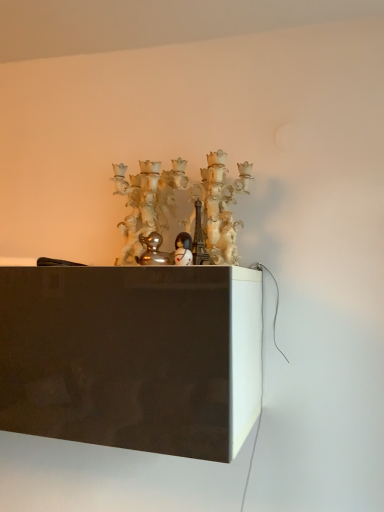
This screenshot has width=384, height=512. I want to click on translucent glass chandelier at center, so click(x=188, y=201).

From the image's perspective, is shiny silver duckling at center, which is counted as the 1th toy, starting from the left, located above or below white glossy figurine at center, which ranks as the 2th toy in left-to-right order?

Clearly, from the image's perspective, shiny silver duckling at center, which is counted as the 1th toy, starting from the left, is above white glossy figurine at center, which ranks as the 2th toy in left-to-right order.

How much distance is there between shiny silver duckling at center, placed as the second toy when sorted from right to left, and white glossy figurine at center, which ranks as the 2th toy in left-to-right order?

shiny silver duckling at center, placed as the second toy when sorted from right to left, and white glossy figurine at center, which ranks as the 2th toy in left-to-right order, are 3.05 inches apart from each other.

Does shiny silver duckling at center, placed as the second toy when sorted from right to left, have a smaller size compared to white glossy figurine at center, which is the 1th toy in right-to-left order?

Incorrect, shiny silver duckling at center, placed as the second toy when sorted from right to left, is not smaller in size than white glossy figurine at center, which is the 1th toy in right-to-left order.

Could you tell me if shiny silver duckling at center, placed as the second toy when sorted from right to left, is facing white glossy figurine at center, which is the 1th toy in right-to-left order?

No.

Which is nearer, (186, 251) or (236, 253)?

Point (186, 251) is positioned closer to the camera compared to point (236, 253).

Does white glossy figurine at center, which is the 1th toy in right-to-left order, turn towards translucent glass chandelier at center?

No, white glossy figurine at center, which is the 1th toy in right-to-left order, does not turn towards translucent glass chandelier at center.

Between white glossy figurine at center, which is the 1th toy in right-to-left order, and translucent glass chandelier at center, which one has less height?

Standing shorter between the two is white glossy figurine at center, which is the 1th toy in right-to-left order.

Considering the relative sizes of white glossy figurine at center, which is the 1th toy in right-to-left order, and translucent glass chandelier at center in the image provided, is white glossy figurine at center, which is the 1th toy in right-to-left order, thinner than translucent glass chandelier at center?

Yes, white glossy figurine at center, which is the 1th toy in right-to-left order, is thinner than translucent glass chandelier at center.

Considering the positions of point (177, 250) and point (165, 262), is point (177, 250) closer or farther from the camera than point (165, 262)?

Point (177, 250) is positioned closer to the camera compared to point (165, 262).

Could you tell me if white glossy figurine at center, which is the 1th toy in right-to-left order, is turned towards shiny silver duckling at center, which is counted as the 1th toy, starting from the left?

No, white glossy figurine at center, which is the 1th toy in right-to-left order, is not turned towards shiny silver duckling at center, which is counted as the 1th toy, starting from the left.

Find the location of a particular element. The width and height of the screenshot is (384, 512). toy that appears in front of the shiny silver duckling at center, which is counted as the 1th toy, starting from the left is located at coordinates (183, 249).

From the image's perspective, count 1st toys downward from the translucent glass chandelier at center and point to it. Please provide its 2D coordinates.

[(154, 251)]

Which is in front, translucent glass chandelier at center or shiny silver duckling at center, which is counted as the 1th toy, starting from the left?

Positioned in front is shiny silver duckling at center, which is counted as the 1th toy, starting from the left.

Is point (198, 194) less distant than point (154, 255)?

That is False.

Between translucent glass chandelier at center and white glossy figurine at center, which ranks as the 2th toy in left-to-right order, which one has more height?

With more height is translucent glass chandelier at center.

Measure the distance between translucent glass chandelier at center and white glossy figurine at center, which is the 1th toy in right-to-left order.

A distance of 18.84 centimeters exists between translucent glass chandelier at center and white glossy figurine at center, which is the 1th toy in right-to-left order.

Consider the image. Is translucent glass chandelier at center in contact with white glossy figurine at center, which is the 1th toy in right-to-left order?

No, translucent glass chandelier at center is not next to white glossy figurine at center, which is the 1th toy in right-to-left order.

Is translucent glass chandelier at center wider or thinner than white glossy figurine at center, which is the 1th toy in right-to-left order?

In the image, translucent glass chandelier at center appears to be wider than white glossy figurine at center, which is the 1th toy in right-to-left order.

Which is in front, shiny silver duckling at center, placed as the second toy when sorted from right to left, or translucent glass chandelier at center?

shiny silver duckling at center, placed as the second toy when sorted from right to left, is in front.

Who is bigger, shiny silver duckling at center, placed as the second toy when sorted from right to left, or translucent glass chandelier at center?

Bigger between the two is translucent glass chandelier at center.

Does shiny silver duckling at center, placed as the second toy when sorted from right to left, turn towards translucent glass chandelier at center?

No, shiny silver duckling at center, placed as the second toy when sorted from right to left, is not turned towards translucent glass chandelier at center.

Is shiny silver duckling at center, which is counted as the 1th toy, starting from the left, at the left side of translucent glass chandelier at center?

Yes.

In the image, there is a white glossy figurine at center, which is the 1th toy in right-to-left order. Where is `toy above it (from the image's perspective)`? toy above it (from the image's perspective) is located at coordinates (154, 251).

I want to click on the 2nd toy below the translucent glass chandelier at center (from the image's perspective), so click(183, 249).

From the image, which object appears to be nearer to shiny silver duckling at center, placed as the second toy when sorted from right to left, white glossy figurine at center, which ranks as the 2th toy in left-to-right order, or translucent glass chandelier at center?

white glossy figurine at center, which ranks as the 2th toy in left-to-right order.

From the image, which object appears to be farther from translucent glass chandelier at center, shiny silver duckling at center, placed as the second toy when sorted from right to left, or white glossy figurine at center, which ranks as the 2th toy in left-to-right order?

The object further to translucent glass chandelier at center is white glossy figurine at center, which ranks as the 2th toy in left-to-right order.

Looking at the image, which one is located further to white glossy figurine at center, which ranks as the 2th toy in left-to-right order, translucent glass chandelier at center or shiny silver duckling at center, placed as the second toy when sorted from right to left?

translucent glass chandelier at center.

Based on their spatial positions, is white glossy figurine at center, which is the 1th toy in right-to-left order, or shiny silver duckling at center, which is counted as the 1th toy, starting from the left, further from translucent glass chandelier at center?

white glossy figurine at center, which is the 1th toy in right-to-left order, lies further to translucent glass chandelier at center than the other object.

When comparing their distances from white glossy figurine at center, which ranks as the 2th toy in left-to-right order, does shiny silver duckling at center, placed as the second toy when sorted from right to left, or translucent glass chandelier at center seem closer?

shiny silver duckling at center, placed as the second toy when sorted from right to left, is closer to white glossy figurine at center, which ranks as the 2th toy in left-to-right order.

Looking at the image, which one is located closer to shiny silver duckling at center, which is counted as the 1th toy, starting from the left, translucent glass chandelier at center or white glossy figurine at center, which ranks as the 2th toy in left-to-right order?

white glossy figurine at center, which ranks as the 2th toy in left-to-right order.

Locate an element on the screen. Image resolution: width=384 pixels, height=512 pixels. toy between shiny silver duckling at center, placed as the second toy when sorted from right to left, and translucent glass chandelier at center, in the horizontal direction is located at coordinates (183, 249).